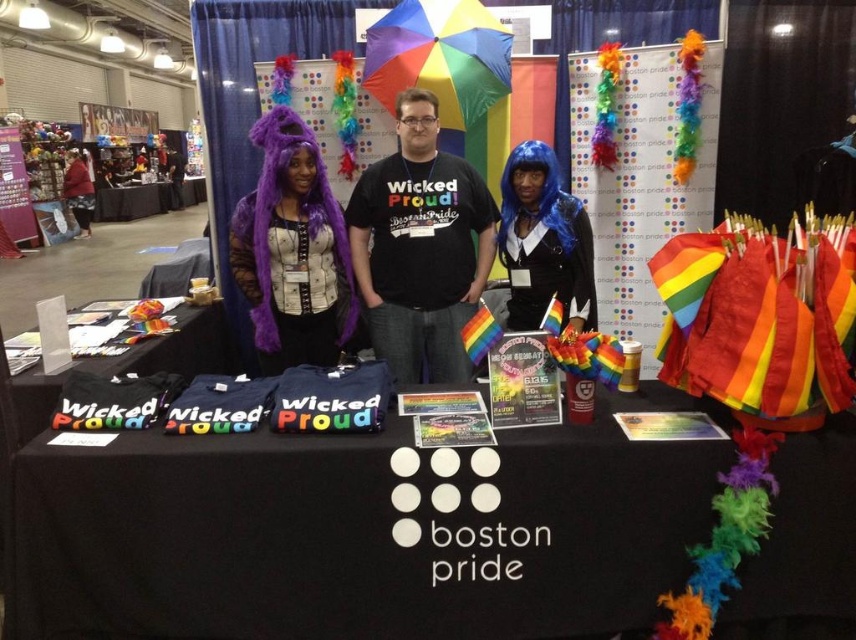
You are organizing a Boston Pride event and need to arrange items on the table. The blue matte wig at center is currently placed where the black fabric table at left is. Would the wig fit better in its original position or the new position?

The blue matte wig at center has a lesser width compared to the black fabric table at left, so it would fit better in its original position since it is narrower and can be placed centrally without overhanging the table edges.

Where is the purple furry wig at upper left located in the image?

The purple furry wig at upper left is located at point (292, 250) in the image.

What are the coordinates of the blue matte wig at center?

The blue matte wig at center is located at coordinates (544, 241).